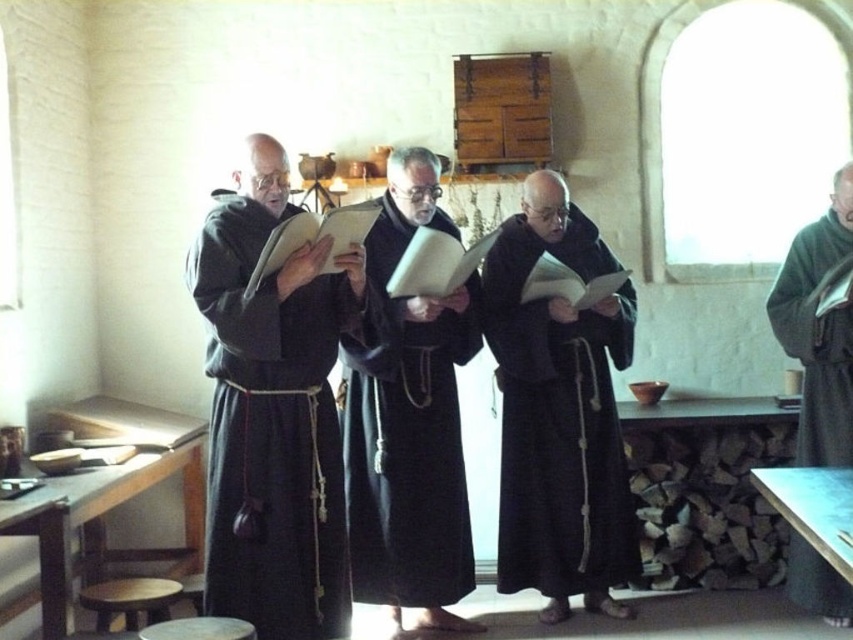
You are standing in the room and want to locate the dark matte robe at center. What are the coordinates where you should look?

The dark matte robe at center is located at coordinates point [405,440].

You are an observer standing at the entrance of the room. You notice two robes worn by the individuals in the scene. Which robe is positioned lower in the image, the dark matte robe at center or the dark woolen robe at right?

The dark matte robe at center is located below the dark woolen robe at right, so the dark matte robe at center is positioned lower in the image.

You are standing in the room where the monks are gathered. You notice two points marked on the wall. The first point is at coordinates point (x=355, y=348) and the second is at point (x=833, y=374). If you were to walk towards the wall, which point would you encounter first?

Point (x=355, y=348) is in front of point (x=833, y=374), so you would encounter point (x=355, y=348) first when walking towards the wall.